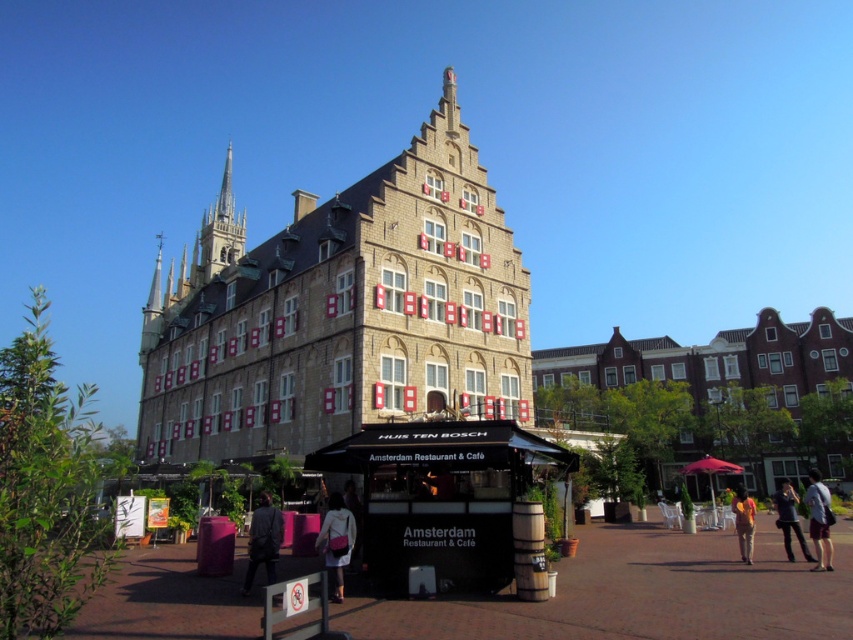
Question: Is beige stone building at center closer to camera compared to smooth stone spire at upper left?

Choices:
 (A) no
 (B) yes

Answer: (B)

Question: Considering the real-world distances, which object is farthest from the white cotton shirt at lower right?

Choices:
 (A) smooth stone spire at upper left
 (B) matte pink purse at center
 (C) dark gray fabric jacket at lower right
 (D) dark gray suit at center

Answer: (A)

Question: Observing the image, what is the correct spatial positioning of brown brick building at center in reference to matte pink purse at center?

Choices:
 (A) below
 (B) above

Answer: (B)

Question: Which point is farther from the camera taking this photo?

Choices:
 (A) (340, 506)
 (B) (221, 220)
 (C) (456, 129)

Answer: (B)

Question: Estimate the real-world distances between objects in this image. Which object is farther from the white cotton shirt at lower right?

Choices:
 (A) dark gray fabric jacket at lower right
 (B) smooth stone spire at upper left
 (C) matte pink purse at center
 (D) yellow fabric bag at lower right

Answer: (B)

Question: Does beige stone building at center have a larger size compared to yellow fabric bag at lower right?

Choices:
 (A) yes
 (B) no

Answer: (A)